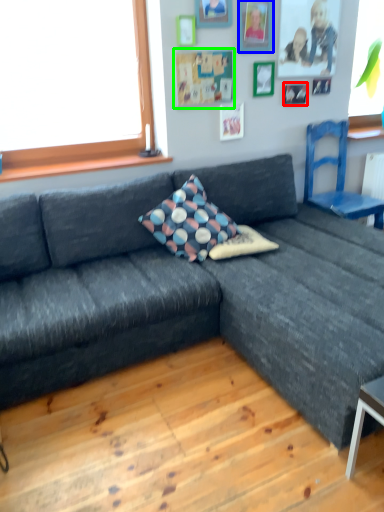
Question: Which object is the closest to the picture frame (highlighted by a red box)? Choose among these: picture frame (highlighted by a blue box) or bulletin board (highlighted by a green box).

Choices:
 (A) picture frame
 (B) bulletin board

Answer: (A)